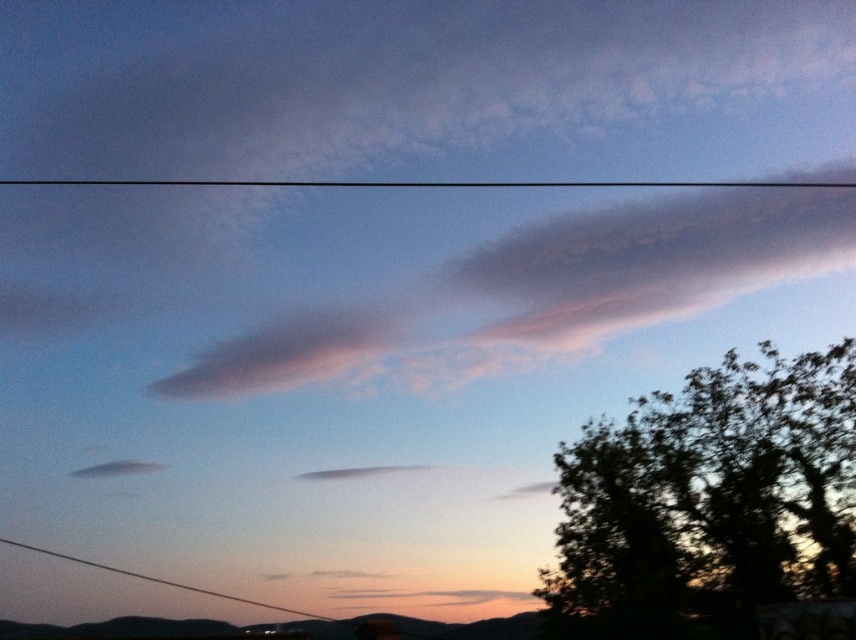
You are an architect designing a new park and want to incorporate elements from this sky scene. If you want to ensure the black wire at lower center is visible against the dark green leafy tree at right, what should you consider based on their sizes?

The dark green leafy tree at right is taller than the black wire at lower center. To ensure visibility, you should position the black wire at lower center in an area where its smaller size contrasts effectively with the tree or use lighting to highlight its presence against the tree.